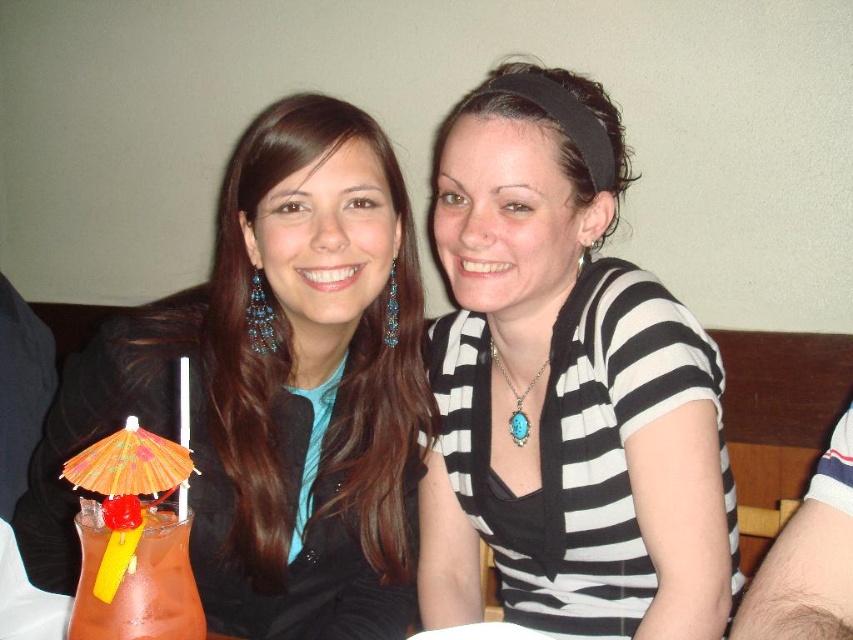
Can you confirm if black striped shirt at center is taller than matte black jacket at left?

Yes, black striped shirt at center is taller than matte black jacket at left.

Is black striped shirt at center wider than matte black jacket at left?

No.

The height and width of the screenshot is (640, 853). I want to click on black striped shirt at center, so click(x=566, y=388).

Is point (378, 497) less distant than point (96, 589)?

No, (378, 497) is behind (96, 589).

Is matte black jacket at left closer to camera compared to matte orange drink at lower left?

No, it is not.

Describe the element at coordinates (276, 390) in the screenshot. This screenshot has height=640, width=853. I see `matte black jacket at left` at that location.

You are a GUI agent. You are given a task and a screenshot of the screen. Output one action in this format:
    pyautogui.click(x=<x>, y=<y>)
    Task: Click on the matte black jacket at left
    This screenshot has height=640, width=853.
    Given the screenshot: What is the action you would take?
    pyautogui.click(x=276, y=390)

Who is lower down, black striped shirt at center or matte orange drink at lower left?

matte orange drink at lower left is lower down.

Can you confirm if black striped shirt at center is positioned below matte orange drink at lower left?

Incorrect, black striped shirt at center is not positioned below matte orange drink at lower left.

Describe the element at coordinates (566, 388) in the screenshot. This screenshot has height=640, width=853. I see `black striped shirt at center` at that location.

Find the location of `black striped shirt at center`. black striped shirt at center is located at coordinates (566, 388).